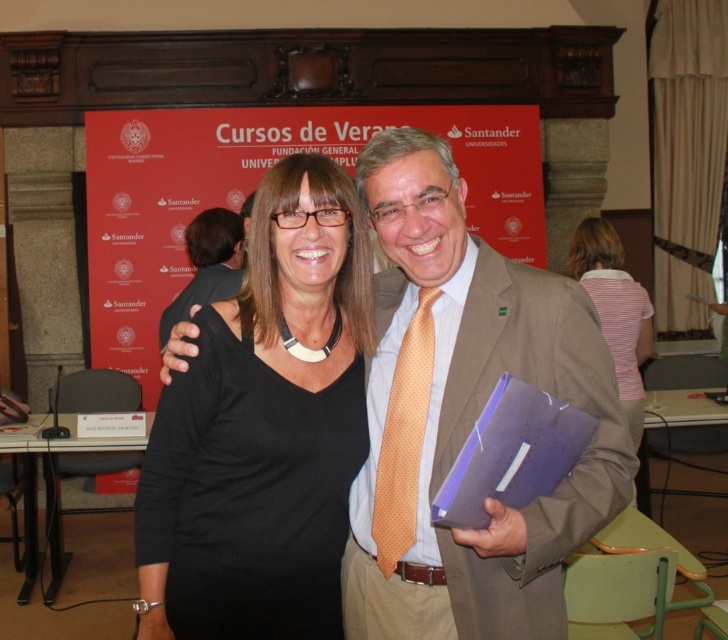
In the scene shown: You are organizing a photoshoot and need to ensure that the matte brown suit at center and the black matte shirt at center are displayed properly. Based on their sizes, which one should you place closer to the camera to maintain visual balance?

The matte brown suit at center is larger in size compared to the black matte shirt at center. To maintain visual balance, you should place the smaller black matte shirt at center closer to the camera so that its apparent size matches the larger matte brown suit at center.

You are attending a formal event and need to choose an outfit that is more compact to move around comfortably. Based on the image, which item would be better suited for this purpose, the matte brown suit at center or the striped fabric shirt at center?

The matte brown suit at center has a smaller size compared to the striped fabric shirt at center, so it would be more compact and better suited for moving around comfortably.